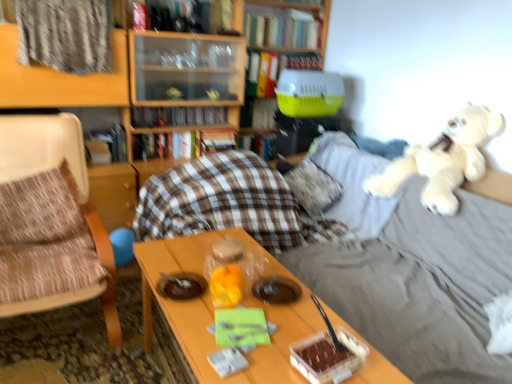
Question: From the image's perspective, is wooden bookcase at upper center under hardcover book at center, which is the seventh book in top-to-bottom order?

Choices:
 (A) no
 (B) yes

Answer: (A)

Question: Is wooden bookcase at upper center thinner than hardcover book at center, which is the seventh book in top-to-bottom order?

Choices:
 (A) no
 (B) yes

Answer: (A)

Question: From a real-world perspective, is wooden bookcase at upper center physically above hardcover book at center, which is the seventh book in top-to-bottom order?

Choices:
 (A) yes
 (B) no

Answer: (A)

Question: Does wooden bookcase at upper center have a greater height compared to hardcover book at center, which is the 2th book from bottom to top?

Choices:
 (A) no
 (B) yes

Answer: (B)

Question: Is wooden bookcase at upper center not near hardcover book at center, which is the 2th book from bottom to top?

Choices:
 (A) no
 (B) yes

Answer: (A)

Question: Is wooden bookcase at upper center touching hardcover book at center, which is the seventh book in top-to-bottom order?

Choices:
 (A) no
 (B) yes

Answer: (A)

Question: From a real-world perspective, is white plush at upper right physically above fluffy white pillow at center?

Choices:
 (A) yes
 (B) no

Answer: (A)

Question: Is white plush at upper right aimed at fluffy white pillow at center?

Choices:
 (A) yes
 (B) no

Answer: (B)

Question: Can you confirm if white plush at upper right is bigger than fluffy white pillow at center?

Choices:
 (A) no
 (B) yes

Answer: (B)

Question: Does white plush at upper right have a greater width compared to fluffy white pillow at center?

Choices:
 (A) no
 (B) yes

Answer: (B)

Question: Does white plush at upper right have a lesser width compared to fluffy white pillow at center?

Choices:
 (A) yes
 (B) no

Answer: (B)

Question: From the image's perspective, is white plush at upper right above fluffy white pillow at center?

Choices:
 (A) no
 (B) yes

Answer: (B)

Question: From a real-world perspective, is hardcover book at upper center, the eighth book from the bottom, positioned over metallic silver book at upper center, positioned as the seventh book in bottom-to-top order, based on gravity?

Choices:
 (A) yes
 (B) no

Answer: (B)